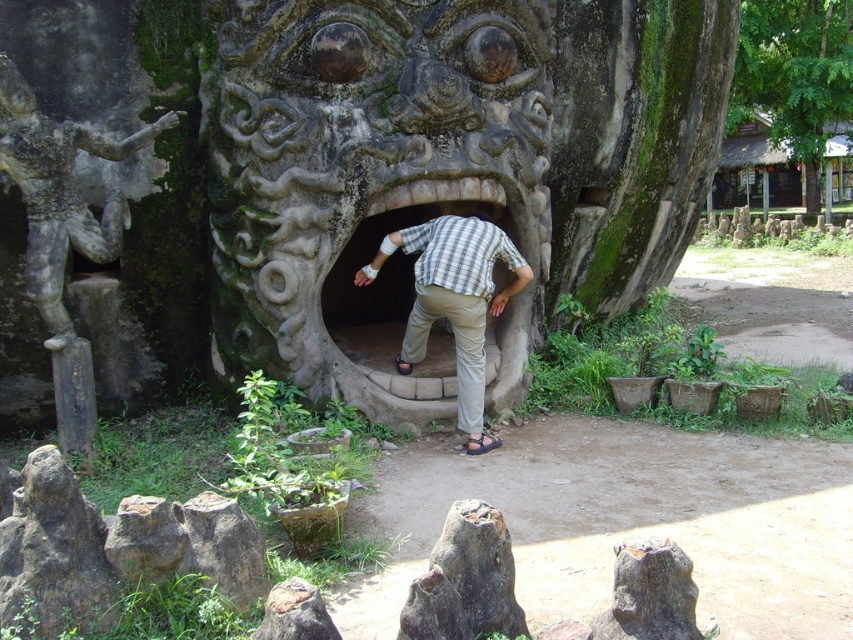
Question: Does green leafy tree at upper right come in front of plaid shirt at center?

Choices:
 (A) yes
 (B) no

Answer: (B)

Question: Can you confirm if stone statue at left is smaller than plaid shirt at center?

Choices:
 (A) no
 (B) yes

Answer: (B)

Question: Can you confirm if stone statue at left is positioned below plaid shirt at center?

Choices:
 (A) yes
 (B) no

Answer: (B)

Question: Which point is closer to the camera?

Choices:
 (A) (833, 35)
 (B) (248, 10)
 (C) (476, 268)
 (D) (495, 442)

Answer: (C)

Question: Which object appears closest to the camera in this image?

Choices:
 (A) green leafy tree at upper right
 (B) plaid shirt at center
 (C) stone textured face at center
 (D) brown leather sandal at center

Answer: (B)

Question: Which object is closer to the camera taking this photo?

Choices:
 (A) plaid shirt at center
 (B) stone statue at left

Answer: (B)